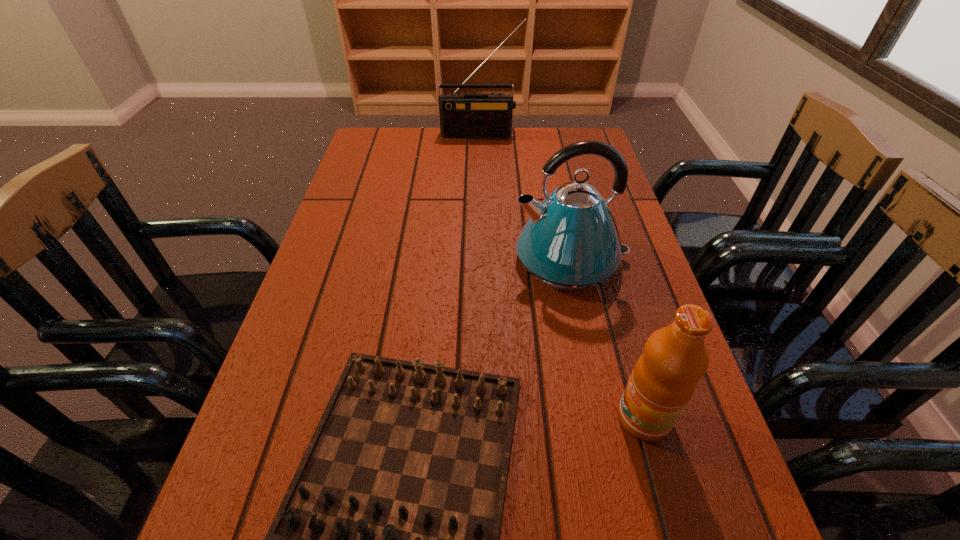
The width and height of the screenshot is (960, 540). Find the location of `object that is at the far edge`. object that is at the far edge is located at coordinates (461, 115).

Locate an element on the screen. Image resolution: width=960 pixels, height=540 pixels. kettle at the right edge is located at coordinates (571, 242).

This screenshot has height=540, width=960. What are the coordinates of `fruit juice that is at the right edge` in the screenshot? It's located at (664, 379).

The width and height of the screenshot is (960, 540). I want to click on blank space at the far edge of the desktop, so click(436, 155).

Locate an element on the screen. vacant area at the left edge of the desktop is located at coordinates (324, 393).

The width and height of the screenshot is (960, 540). In the image, there is a desktop. Find the location of `vacant space at the right edge`. vacant space at the right edge is located at coordinates (596, 349).

In the image, there is a desktop. What are the coordinates of `vacant space at the far left corner` in the screenshot? It's located at coord(366,150).

At what (x,y) coordinates should I click in order to perform the action: click on vacant area at the far right corner. Please return your answer as a coordinate pair (x, y). Looking at the image, I should click on (584, 137).

Locate an element on the screen. The width and height of the screenshot is (960, 540). vacant space that is in between the fruit juice and the second farthest object is located at coordinates (607, 339).

Where is `empty space that is in between the fruit juice and the kettle`? The image size is (960, 540). empty space that is in between the fruit juice and the kettle is located at coordinates (607, 339).